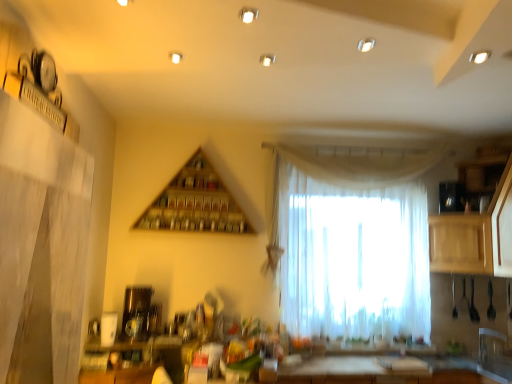
Question: From a real-world perspective, is wooden triangle at upper center physically below light wood cabinet at right, the 2th cabinetry in the back-to-front sequence?

Choices:
 (A) no
 (B) yes

Answer: (A)

Question: Is the surface of wooden triangle at upper center in direct contact with light wood cabinet at right, which is counted as the 1th cabinetry, starting from the front?

Choices:
 (A) no
 (B) yes

Answer: (A)

Question: Does wooden triangle at upper center appear on the left side of light wood cabinet at right, which is counted as the 1th cabinetry, starting from the front?

Choices:
 (A) no
 (B) yes

Answer: (B)

Question: Does wooden triangle at upper center lie in front of light wood cabinet at right, the 2th cabinetry in the back-to-front sequence?

Choices:
 (A) yes
 (B) no

Answer: (B)

Question: Are wooden triangle at upper center and light wood cabinet at right, which is counted as the 1th cabinetry, starting from the front, far apart?

Choices:
 (A) no
 (B) yes

Answer: (B)

Question: From the image's perspective, relative to satin gold coffee maker at lower left, is white sheer curtain at center above or below?

Choices:
 (A) above
 (B) below

Answer: (A)

Question: Considering the positions of point (403, 251) and point (128, 294), is point (403, 251) closer or farther from the camera than point (128, 294)?

Choices:
 (A) closer
 (B) farther

Answer: (B)

Question: From a real-world perspective, relative to satin gold coffee maker at lower left, is white sheer curtain at center vertically above or below?

Choices:
 (A) below
 (B) above

Answer: (B)

Question: Is white sheer curtain at center wider or thinner than satin gold coffee maker at lower left?

Choices:
 (A) thin
 (B) wide

Answer: (A)

Question: From the image's perspective, is wooden cabinet at right, arranged as the 1th cabinetry when viewed from the back, above or below white sheer curtain at center?

Choices:
 (A) above
 (B) below

Answer: (B)

Question: Is wooden cabinet at right, which is the second cabinetry in front-to-back order, bigger or smaller than white sheer curtain at center?

Choices:
 (A) small
 (B) big

Answer: (B)

Question: Relative to white sheer curtain at center, is wooden cabinet at right, arranged as the 1th cabinetry when viewed from the back, in front or behind?

Choices:
 (A) front
 (B) behind

Answer: (A)

Question: Is wooden cabinet at right, which is the second cabinetry in front-to-back order, inside or outside of white sheer curtain at center?

Choices:
 (A) outside
 (B) inside

Answer: (A)

Question: Is wooden cabinet at right, which is the second cabinetry in front-to-back order, taller or shorter than wooden triangle at upper center?

Choices:
 (A) tall
 (B) short

Answer: (B)

Question: Visually, is wooden cabinet at right, arranged as the 1th cabinetry when viewed from the back, positioned to the left or to the right of wooden triangle at upper center?

Choices:
 (A) right
 (B) left

Answer: (A)